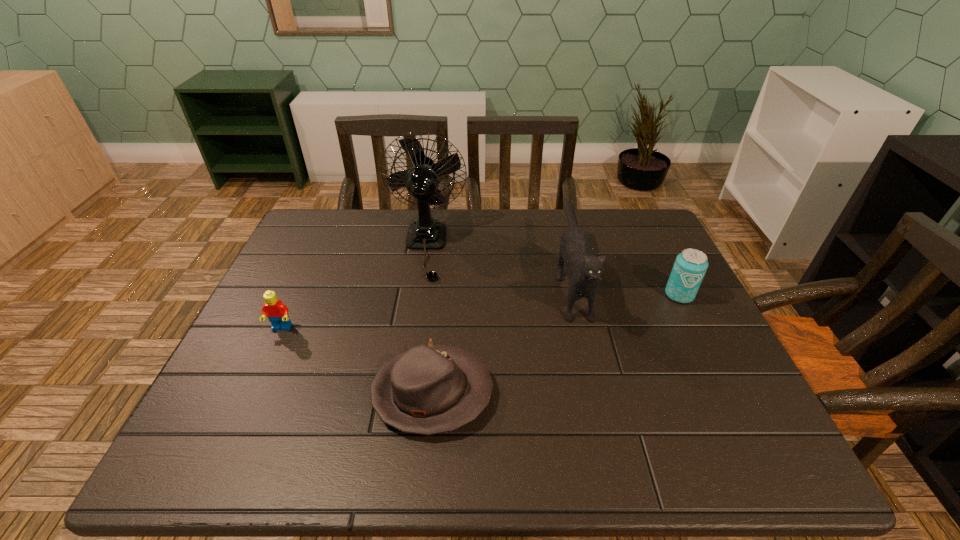
Locate an element on the screen. This screenshot has width=960, height=540. free space between the fourth object from left to right and the tallest object is located at coordinates (498, 264).

Locate an element on the screen. free spot between the hat and the fourth shortest object is located at coordinates pyautogui.click(x=501, y=337).

Find the location of `empty space between the shortest object and the fourth shortest object`. empty space between the shortest object and the fourth shortest object is located at coordinates (501, 337).

Locate which object is the second closest to the tallest object. Please provide its 2D coordinates. Your answer should be formatted as a tuple, i.e. [(x, y)], where the tuple contains the x and y coordinates of a point satisfying the conditions above.

[(427, 390)]

Find the location of a particular element. The height and width of the screenshot is (540, 960). object that is the fourth nearest to the nearest object is located at coordinates (690, 266).

Locate an element on the screen. This screenshot has width=960, height=540. vacant space that satisfies the following two spatial constraints: 1. in front of the fan, indicating the direction of air flow; 2. on the left side of the rightmost object is located at coordinates (418, 295).

This screenshot has width=960, height=540. Identify the location of free space that satisfies the following two spatial constraints: 1. in front of the tallest object, indicating the direction of air flow; 2. on the left side of the rightmost object. (418, 295).

Identify the location of free region that satisfies the following two spatial constraints: 1. on the front-facing side of the fourth shortest object; 2. on the decorative side of the nearest object. (597, 393).

Where is `vacant space that satisfies the following two spatial constraints: 1. on the front-facing side of the cat; 2. on the left side of the beer can`? This screenshot has width=960, height=540. vacant space that satisfies the following two spatial constraints: 1. on the front-facing side of the cat; 2. on the left side of the beer can is located at coordinates (574, 295).